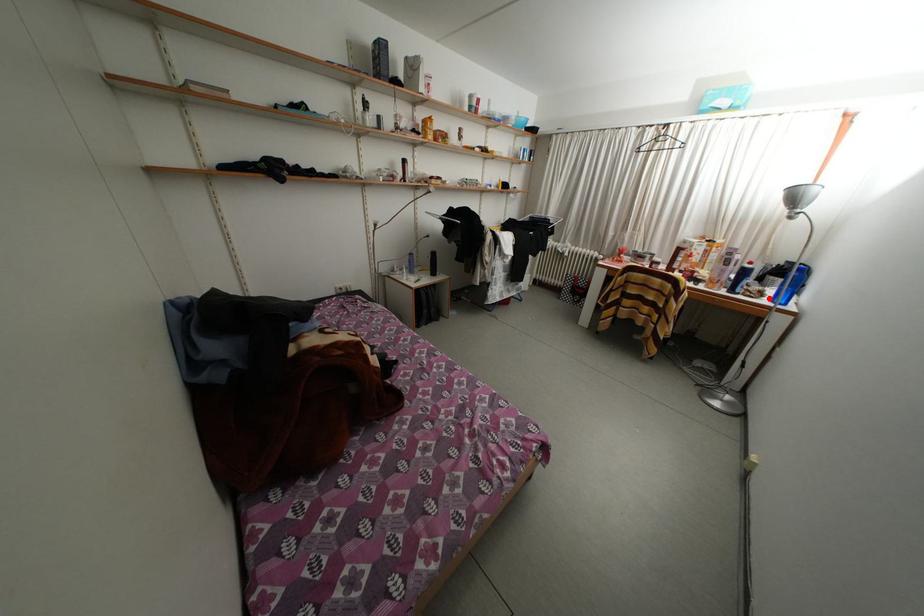
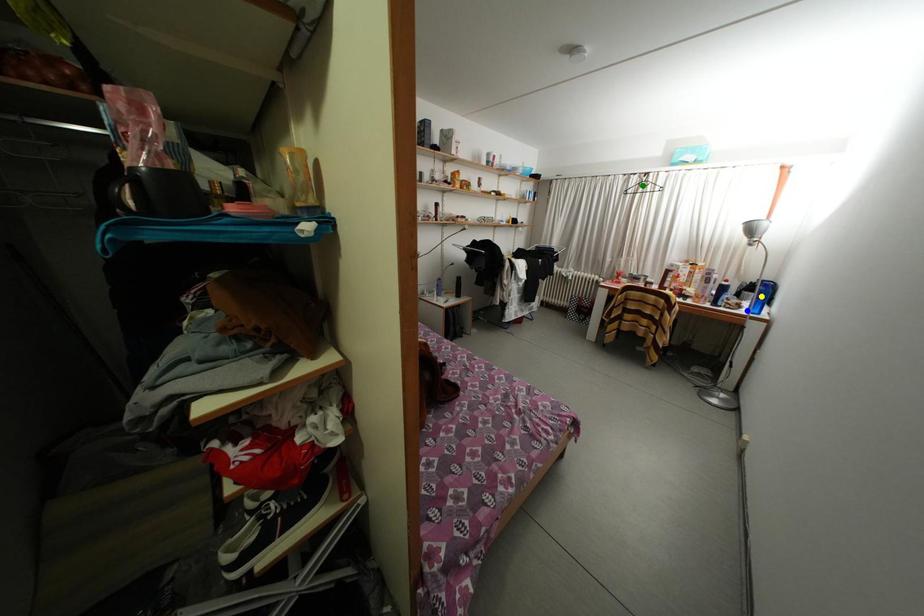
Question: I am providing you with two images of the same scene from different viewpoints. A red point is marked on the first image. You are given multiple points on the second image. In image 2, which mark is for the same physical point as the one in image 1?

Choices:
 (A) blue point
 (B) yellow point
 (C) green point

Answer: (A)